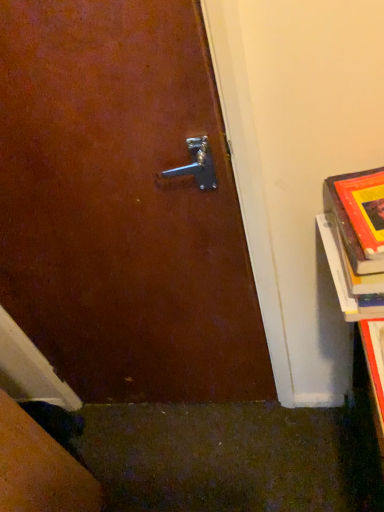
Question: From the image's perspective, does hardcover book at lower right appear lower than hardcover book at right?

Choices:
 (A) yes
 (B) no

Answer: (A)

Question: Can hardcover book at right be found inside hardcover book at lower right?

Choices:
 (A) no
 (B) yes

Answer: (A)

Question: Is hardcover book at lower right taller than hardcover book at right?

Choices:
 (A) no
 (B) yes

Answer: (A)

Question: Is hardcover book at lower right to the left of hardcover book at right from the viewer's perspective?

Choices:
 (A) yes
 (B) no

Answer: (A)

Question: Can you confirm if hardcover book at lower right is positioned to the right of hardcover book at right?

Choices:
 (A) yes
 (B) no

Answer: (B)

Question: Is hardcover book at lower right positioned beyond the bounds of hardcover book at right?

Choices:
 (A) yes
 (B) no

Answer: (A)

Question: Is hardcover book at right not within hardcover book at lower right?

Choices:
 (A) no
 (B) yes

Answer: (B)

Question: Does hardcover book at right turn towards hardcover book at lower right?

Choices:
 (A) yes
 (B) no

Answer: (A)

Question: Is hardcover book at right in contact with hardcover book at lower right?

Choices:
 (A) yes
 (B) no

Answer: (B)

Question: Does hardcover book at right have a lesser height compared to hardcover book at lower right?

Choices:
 (A) no
 (B) yes

Answer: (A)

Question: Does hardcover book at right contain hardcover book at lower right?

Choices:
 (A) yes
 (B) no

Answer: (B)

Question: Is hardcover book at right thinner than hardcover book at lower right?

Choices:
 (A) yes
 (B) no

Answer: (B)

Question: Looking at their shapes, would you say hardcover book at lower right is wider or thinner than hardcover book at right?

Choices:
 (A) wide
 (B) thin

Answer: (B)